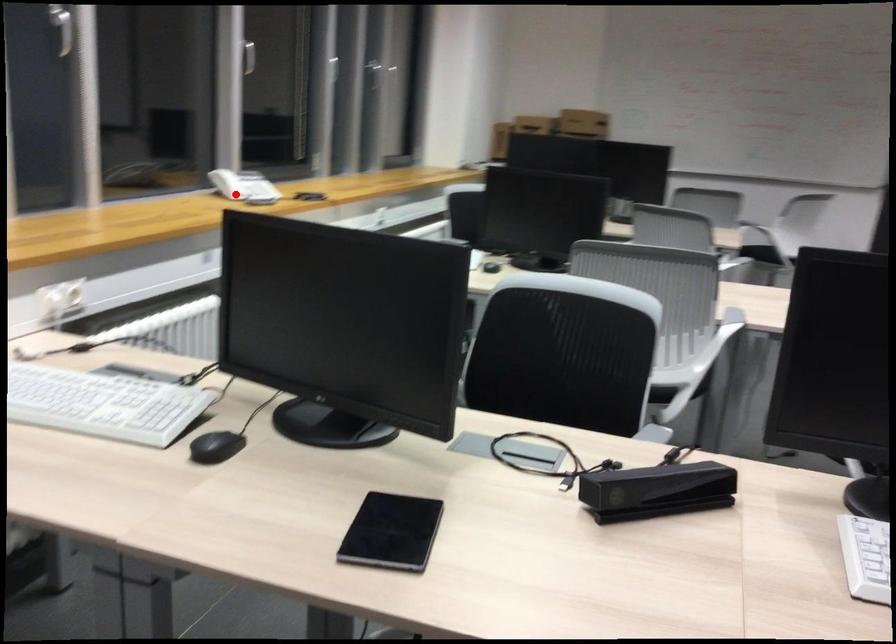
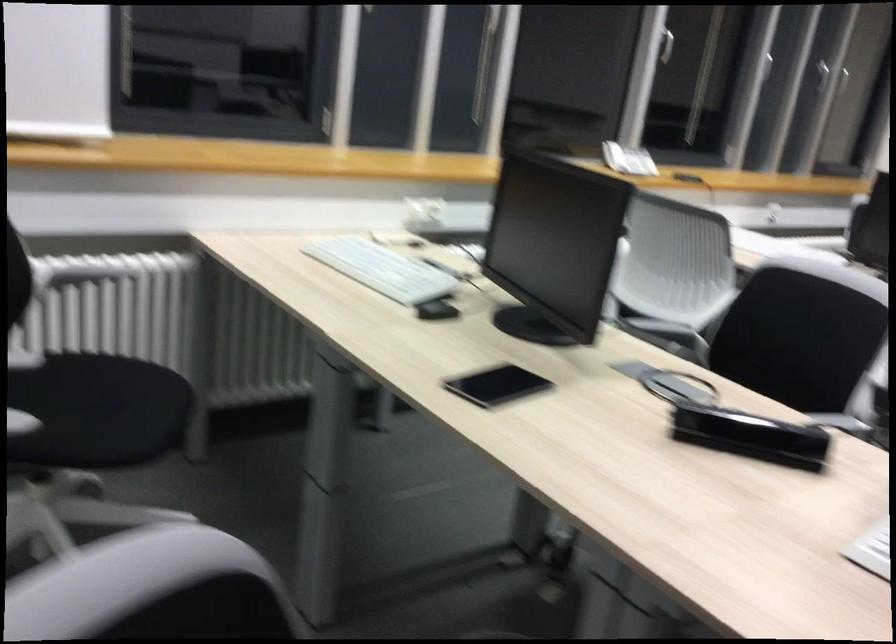
Find the pixel in the second image that matches the highlighted location in the first image.

(614, 156)